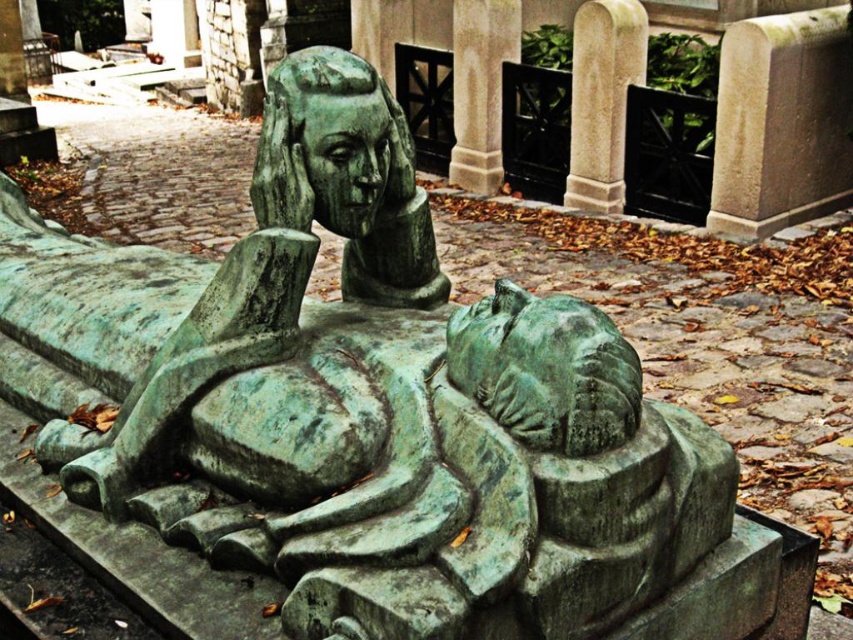
What do you see at coordinates (602, 99) in the screenshot?
I see `smooth stone pillar at center` at bounding box center [602, 99].

Is smooth stone pillar at center positioned behind smooth stone pillar at upper center?

No, it is in front of smooth stone pillar at upper center.

Between point (611, 36) and point (485, 129), which one is positioned in front?

Positioned in front is point (611, 36).

The height and width of the screenshot is (640, 853). Identify the location of smooth stone pillar at center. (602, 99).

The width and height of the screenshot is (853, 640). Identify the location of green patina bust at center. (346, 176).

Is green patina bust at center smaller than smooth stone pillar at upper center?

Indeed, green patina bust at center has a smaller size compared to smooth stone pillar at upper center.

Is point (428, 212) positioned in front of point (496, 148)?

Yes.

Locate an element on the screen. The image size is (853, 640). green patina bust at center is located at coordinates (346, 176).

At what (x,y) coordinates should I click in order to perform the action: click on green patina bust at center. Please return your answer as a coordinate pair (x, y). Looking at the image, I should click on (346, 176).

Does green patina bust at center lie behind smooth stone pillar at center?

No, it is not.

Image resolution: width=853 pixels, height=640 pixels. What do you see at coordinates (346, 176) in the screenshot?
I see `green patina bust at center` at bounding box center [346, 176].

The height and width of the screenshot is (640, 853). I want to click on green patina bust at center, so click(346, 176).